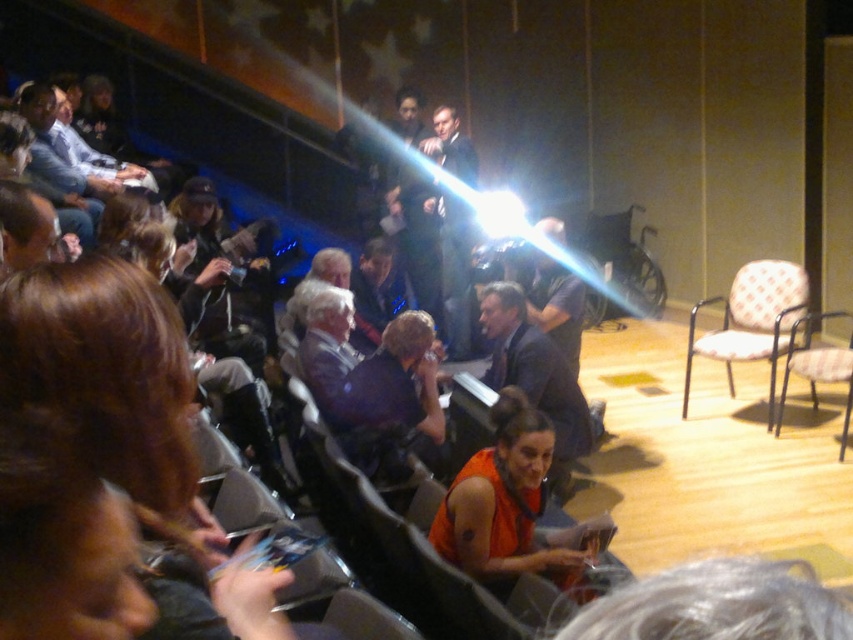
Does orange fabric tank top at center come in front of light beige fabric chair at right?

Yes.

Is point (509, 458) positioned before point (751, 317)?

Yes, it is in front of point (751, 317).

Where is `orange fabric tank top at center`? This screenshot has width=853, height=640. orange fabric tank top at center is located at coordinates (511, 508).

What are the coordinates of `orange fabric tank top at center` in the screenshot? It's located at click(511, 508).

Is orange sleeveless top at center positioned behind orange fabric tank top at center?

No, orange sleeveless top at center is in front of orange fabric tank top at center.

Can you confirm if orange sleeveless top at center is wider than orange fabric tank top at center?

No.

Identify the location of orange sleeveless top at center. This screenshot has height=640, width=853. (90, 445).

Consider the image. Can you confirm if light beige fabric chair at right is bigger than metallic gray chair at lower center?

Yes, light beige fabric chair at right is bigger than metallic gray chair at lower center.

Between light beige fabric chair at right and metallic gray chair at lower center, which one has more height?

With more height is light beige fabric chair at right.

Find the location of a particular element. The image size is (853, 640). light beige fabric chair at right is located at coordinates (752, 321).